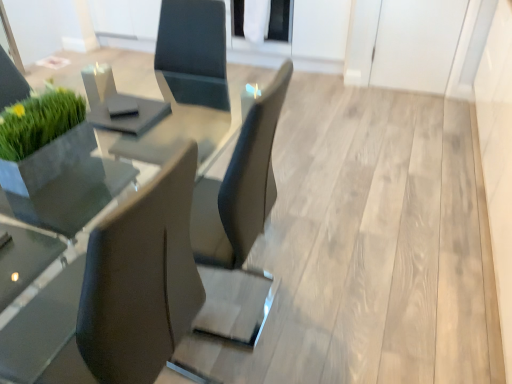
This screenshot has width=512, height=384. I want to click on free location to the right of clear glass table at center, so click(x=341, y=277).